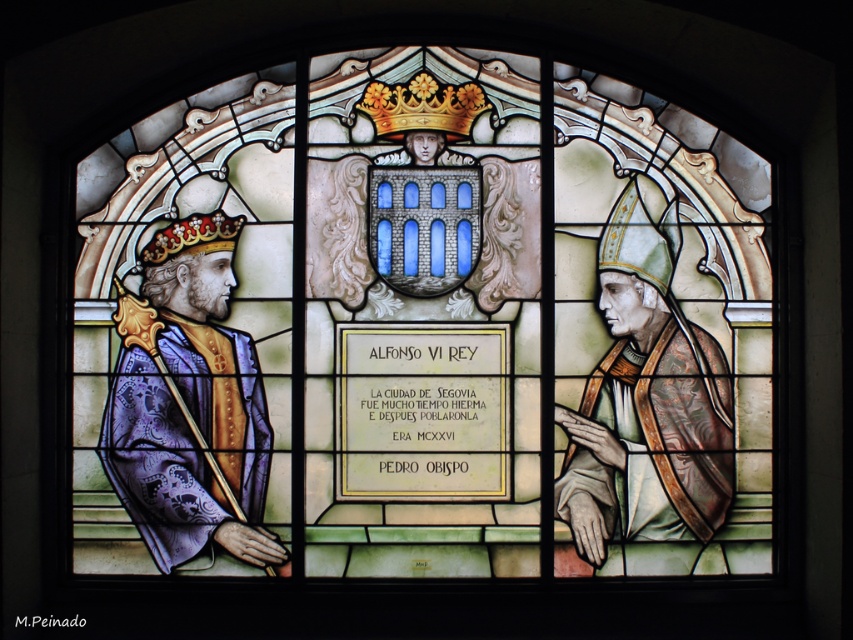
Question: Which point is farther to the camera?

Choices:
 (A) purple velvet robe at left
 (B) gold textured crown at upper left
 (C) green velvet robe at right
 (D) gold textured crown at center

Answer: (D)

Question: Which point appears farthest from the camera in this image?

Choices:
 (A) (244, 556)
 (B) (444, 112)
 (C) (573, 509)

Answer: (B)

Question: From the image, what is the correct spatial relationship of purple velvet robe at left in relation to gold textured crown at center?

Choices:
 (A) above
 (B) below

Answer: (B)

Question: Does green velvet robe at right lie behind gold textured crown at upper left?

Choices:
 (A) yes
 (B) no

Answer: (B)

Question: Which point is closer to the camera taking this photo?

Choices:
 (A) (225, 221)
 (B) (389, 102)

Answer: (A)

Question: Does green velvet robe at right have a larger size compared to gold textured crown at upper left?

Choices:
 (A) no
 (B) yes

Answer: (B)